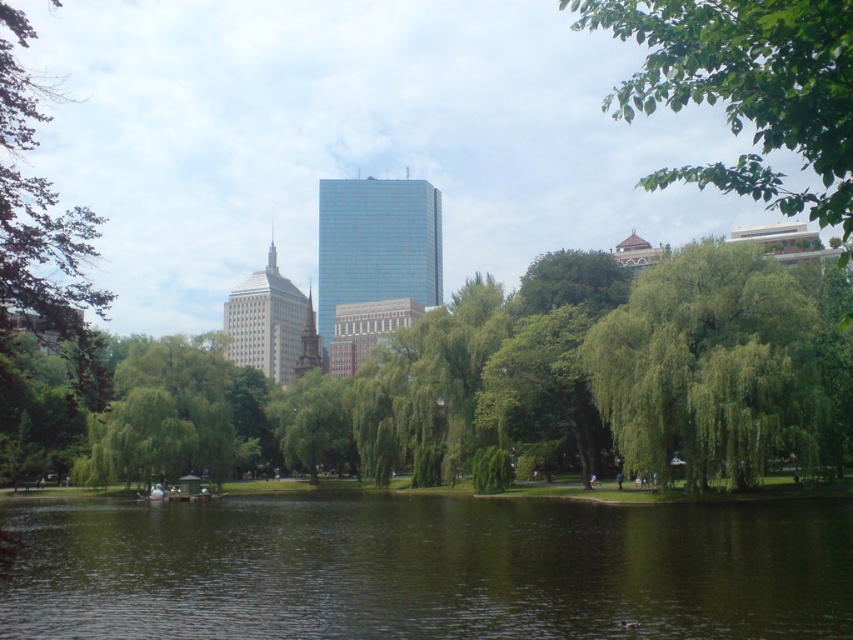
You are standing at the center of the park and want to locate the green reflective water at center. According to the coordinates provided, in which direction should you look to find it?

The green reflective water at center is located at coordinates point (428, 570), so you should look towards the lower right direction from the center of the park.

You are standing at the center of the park and want to take a photo of the green leafy tree at center. Which direction should you face to capture it in your viewfinder?

The green leafy tree at center is located at point (x=711, y=365), so you should face towards the center of the park to capture it in your viewfinder.